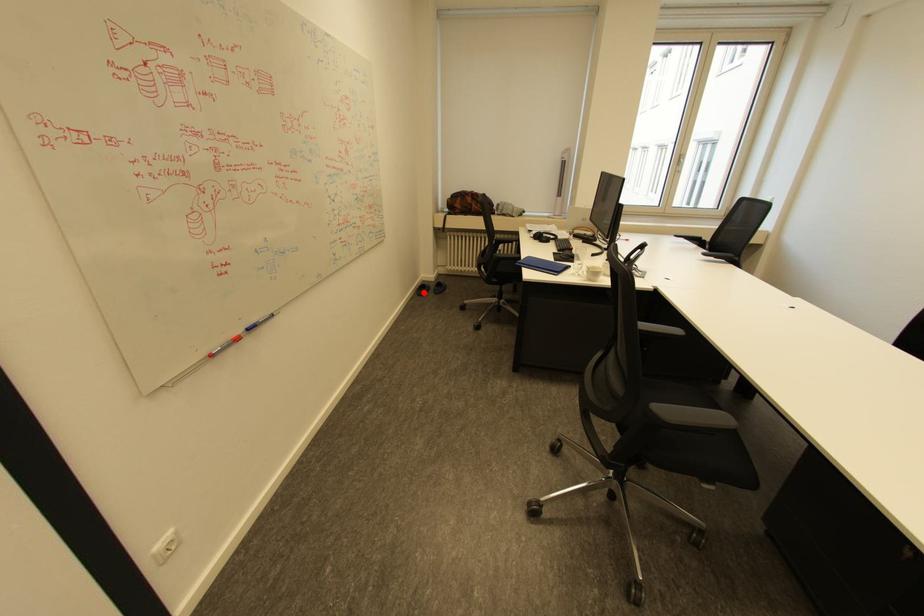
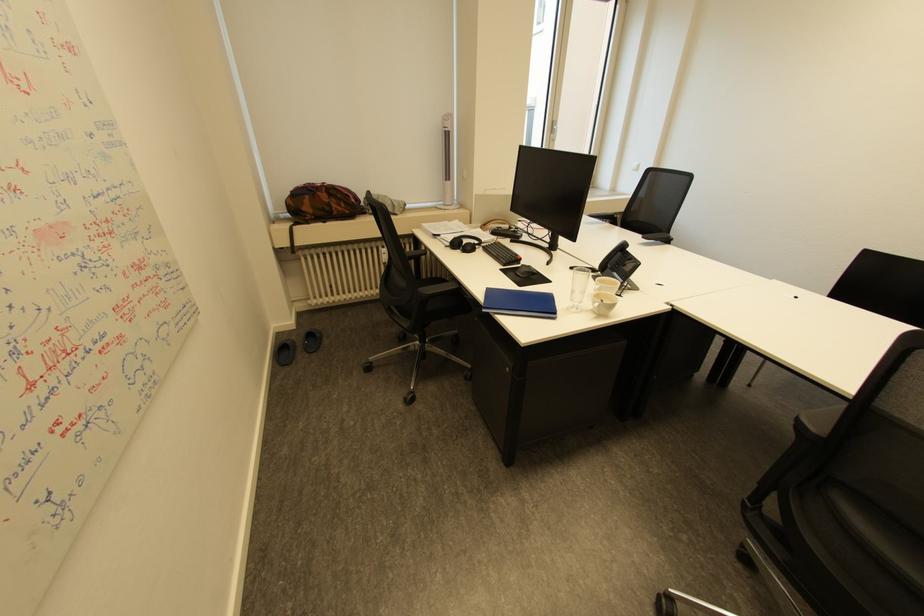
Locate, in the second image, the point that corresponds to the highlighted location in the first image.

(284, 361)